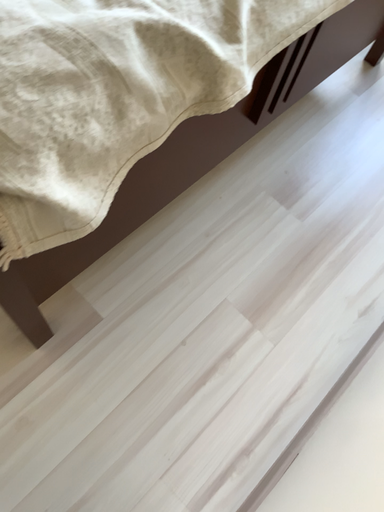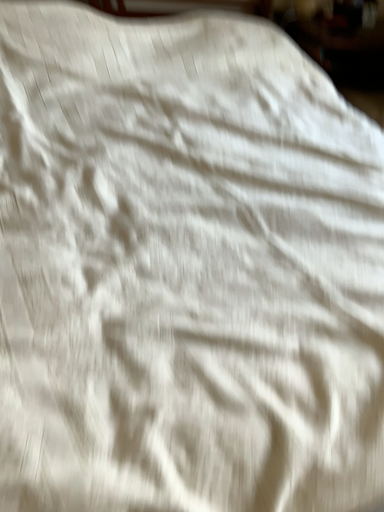
Question: How did the camera likely rotate when shooting the video?

Choices:
 (A) rotated downward
 (B) rotated upward

Answer: (B)